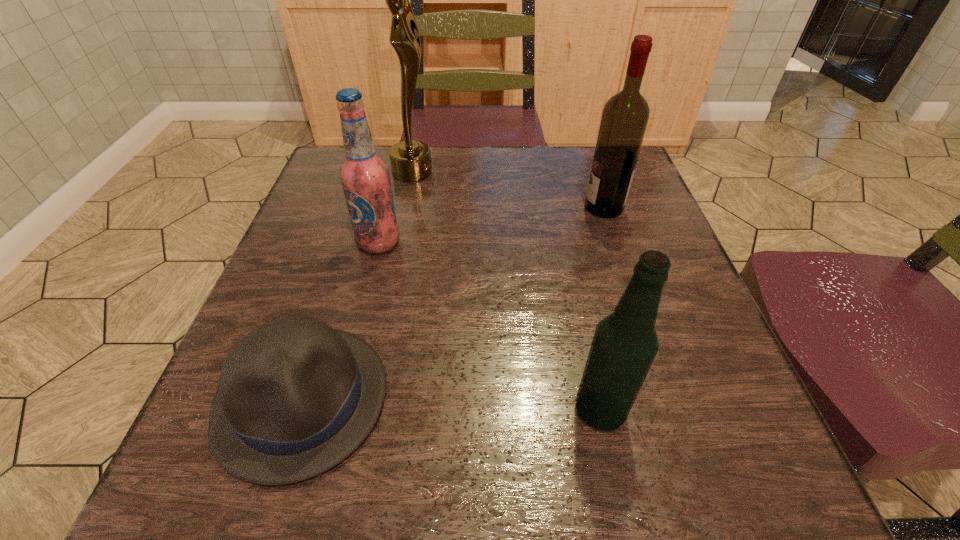
In order to click on free area in between the bowler hat and the fourth object from left to right in this screenshot , I will do `click(451, 404)`.

At what (x,y) coordinates should I click in order to perform the action: click on vacant area that lies between the bowler hat and the third nearest object. Please return your answer as a coordinate pair (x, y). Looking at the image, I should click on (340, 321).

Locate an element on the screen. The width and height of the screenshot is (960, 540). vacant area between the rightmost object and the shortest object is located at coordinates (453, 303).

Find the location of a particular element. Image resolution: width=960 pixels, height=540 pixels. free space between the second nearest alcohol and the nearest alcohol is located at coordinates (490, 326).

The image size is (960, 540). I want to click on vacant space that's between the second object from right to left and the second farthest object, so click(x=602, y=308).

Where is `free area in between the bowler hat and the award`? The height and width of the screenshot is (540, 960). free area in between the bowler hat and the award is located at coordinates (357, 285).

This screenshot has width=960, height=540. I want to click on vacant area that lies between the bowler hat and the second alcohol from left to right, so click(451, 404).

The image size is (960, 540). I want to click on object that is the third closest to the rightmost object, so click(625, 343).

Locate which object ranks third in proximity to the nearest alcohol. Please provide its 2D coordinates. Your answer should be formatted as a tuple, i.e. [(x, y)], where the tuple contains the x and y coordinates of a point satisfying the conditions above.

[(365, 177)]

Identify the location of the second closest alcohol to the rightmost alcohol. The width and height of the screenshot is (960, 540). (625, 343).